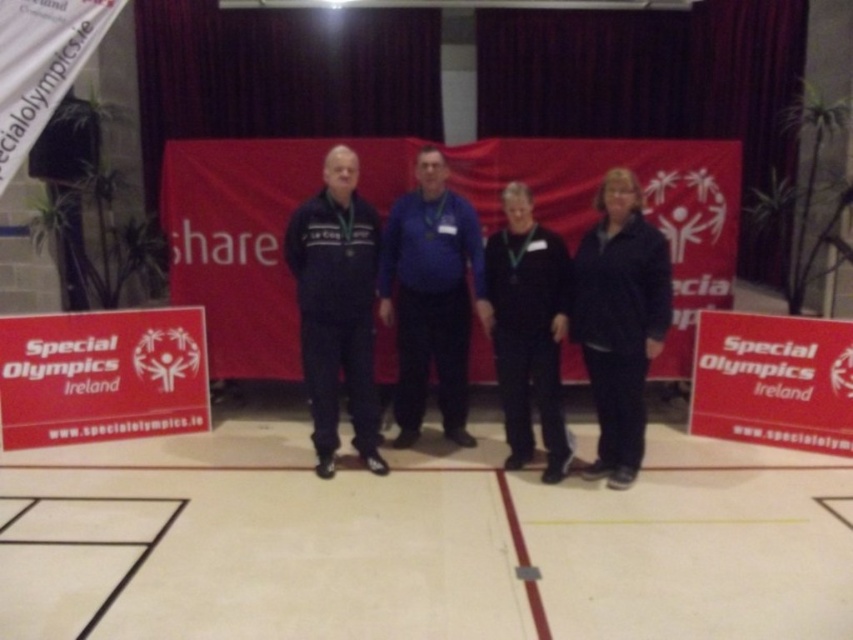
You are a photographer at the event and need to adjust the lighting so that both the blue fabric shirt at center and the black matte jacket at center are equally visible. Considering their sizes, which one might require more focused lighting adjustments?

The blue fabric shirt at center is much taller than the black matte jacket at center, so the photographer should focus more lighting adjustments on the blue fabric shirt at center to ensure it doesn not overshadow the smaller jacket.

You are a photographer at the Special Olympics Ireland event. You need to capture a clear photo of the medal of the person wearing the matte blue tracksuit at center and the black matte jacket at center. Since both are at the center, which clothing item is covering part of the medal, making it harder to see?

The matte blue tracksuit at center is positioned over the black matte jacket at center, so the medal might be partially covered by the matte blue tracksuit at center, making it harder to see.